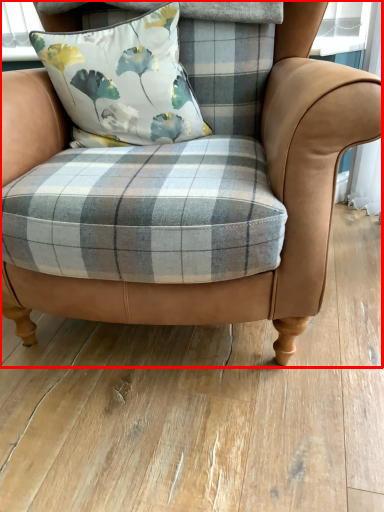
Question: From the image's perspective, what is the correct spatial relationship of chair (annotated by the red box) in relation to pillow?

Choices:
 (A) above
 (B) below

Answer: (B)